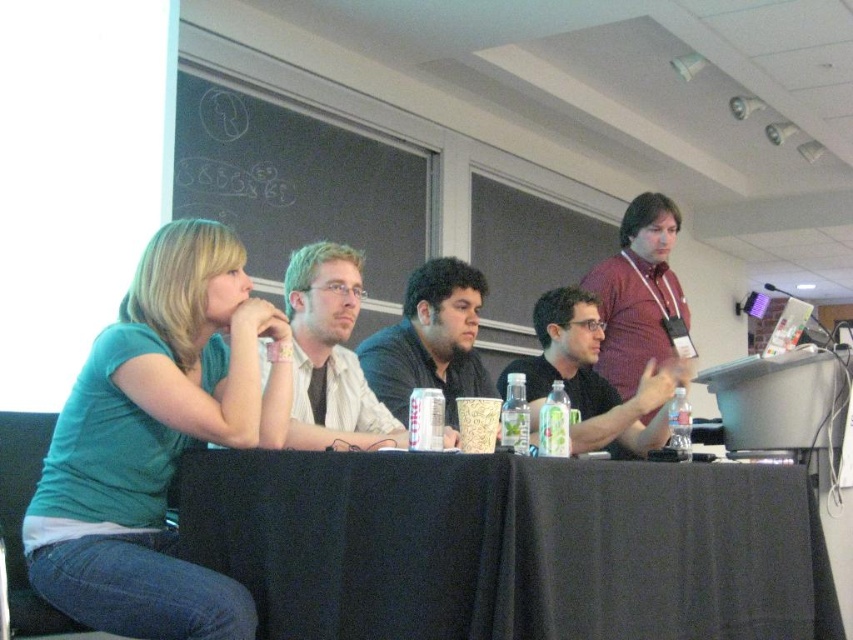
Is point (595, 435) positioned after point (399, 339)?

No, (595, 435) is in front of (399, 339).

Locate an element on the screen. This screenshot has width=853, height=640. matte black shirt at center is located at coordinates (592, 378).

Describe the element at coordinates (509, 547) in the screenshot. The height and width of the screenshot is (640, 853). I see `black fabric table at center` at that location.

Find the location of `black fabric table at center`. black fabric table at center is located at coordinates (509, 547).

Does black fabric table at center have a greater width compared to matte white shirt at center?

Yes.

Does black fabric table at center have a greater height compared to matte white shirt at center?

Indeed, black fabric table at center has a greater height compared to matte white shirt at center.

Which is behind, point (558, 552) or point (337, 324)?

Positioned behind is point (337, 324).

The height and width of the screenshot is (640, 853). In order to click on black fabric table at center in this screenshot , I will do `click(509, 547)`.